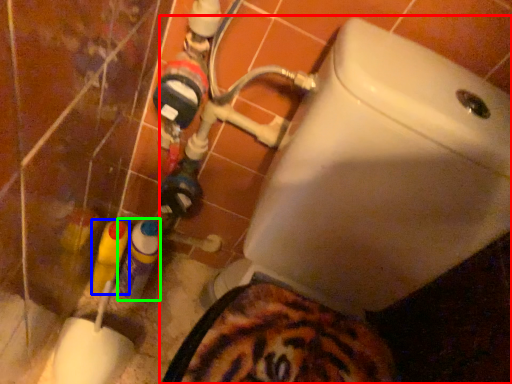
Question: Estimate the real-world distances between objects in this image. Which object is farther from toilet (highlighted by a red box), bottle (highlighted by a blue box) or bottle (highlighted by a green box)?

Choices:
 (A) bottle
 (B) bottle

Answer: (A)